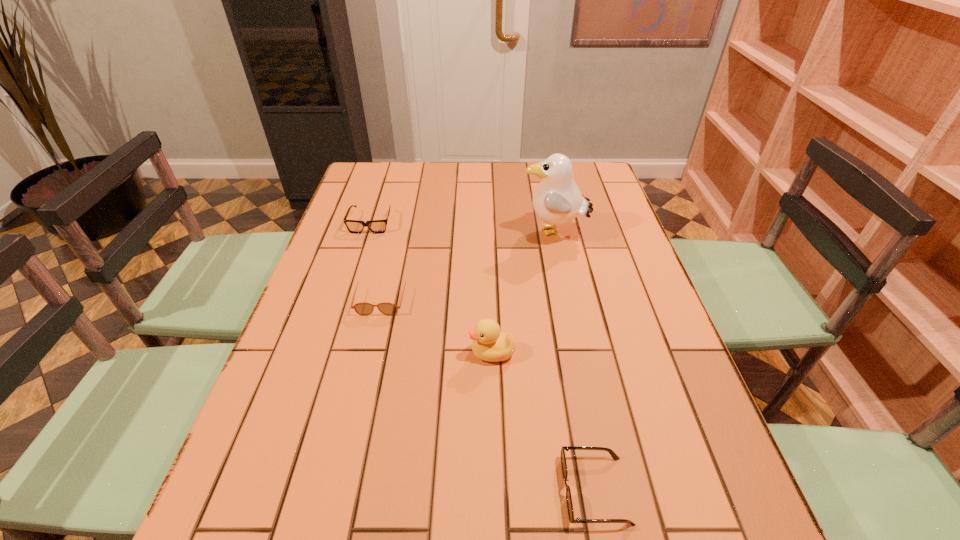
Identify the location of vacant area located on the face of the fourth farthest object. (407, 353).

Where is `free location located 0.270m on the face of the fourth farthest object`? This screenshot has height=540, width=960. free location located 0.270m on the face of the fourth farthest object is located at coordinates (349, 353).

Image resolution: width=960 pixels, height=540 pixels. Find the location of `free space located 0.240m on the face of the fourth farthest object`. free space located 0.240m on the face of the fourth farthest object is located at coordinates (363, 353).

Identify the location of free region located 0.170m on the front-facing side of the farthest sunglasses. (355, 272).

At what (x,y) coordinates should I click in order to perform the action: click on vacant area situated 0.260m on the front-facing side of the third farthest object. Please return your answer as a coordinate pair (x, y). Looking at the image, I should click on (355, 410).

Image resolution: width=960 pixels, height=540 pixels. In order to click on free location located on the front-facing side of the rightmost sunglasses in this screenshot , I will do `click(386, 490)`.

At what (x,y) coordinates should I click in order to perform the action: click on vacant space positioned on the front-facing side of the rightmost sunglasses. Please return your answer as a coordinate pair (x, y). The image size is (960, 540). Looking at the image, I should click on (374, 490).

Locate an element on the screen. vacant area situated on the front-facing side of the rightmost sunglasses is located at coordinates (409, 490).

Identify the location of object located in the near edge section of the desktop. (563, 459).

Locate an element on the screen. object that is at the right edge is located at coordinates (557, 200).